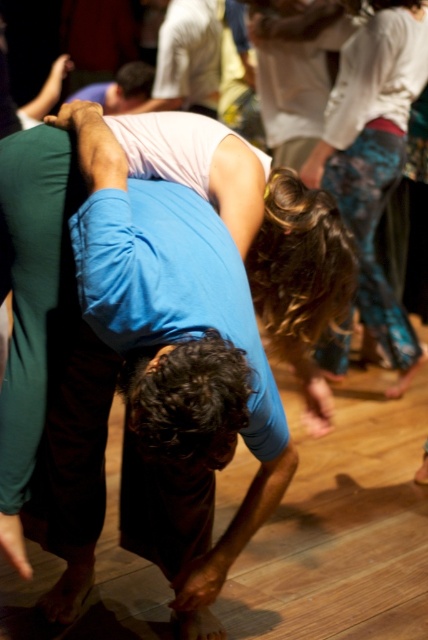
Which is in front, point (219, 369) or point (302, 48)?

Positioned in front is point (219, 369).

The image size is (428, 640). I want to click on blue cotton shirt at center, so (155, 380).

At what (x,y) coordinates should I click in order to perform the action: click on blue cotton shirt at center. Please return your answer as a coordinate pair (x, y). The height and width of the screenshot is (640, 428). Looking at the image, I should click on (155, 380).

Between blue tie-dye pants at right and white cotton shirt at upper center, which one is positioned lower?

blue tie-dye pants at right is below.

Who is more distant from viewer, [395,88] or [315,131]?

Positioned behind is point [315,131].

At what (x,y) coordinates should I click in order to perform the action: click on blue tie-dye pants at right. Please return your answer as a coordinate pair (x, y). The height and width of the screenshot is (640, 428). Looking at the image, I should click on (374, 156).

Is blue cotton shirt at center smaller than blue tie-dye pants at right?

Correct, blue cotton shirt at center occupies less space than blue tie-dye pants at right.

Between blue cotton shirt at center and blue tie-dye pants at right, which one has more height?

blue tie-dye pants at right

Find the location of a particular element. The width and height of the screenshot is (428, 640). blue cotton shirt at center is located at coordinates (155, 380).